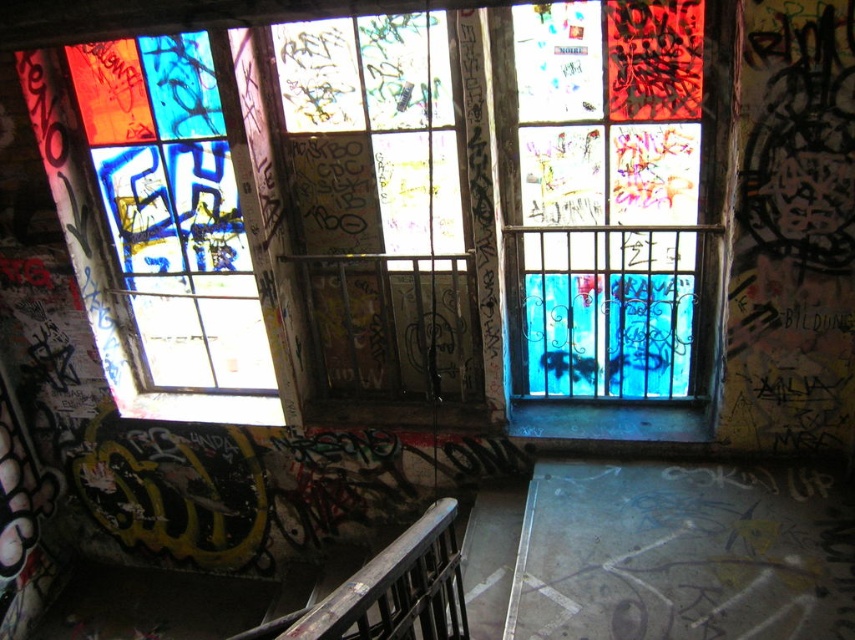
structural integrity is a concern in this abandoned building. You need to inspect the stained glass window at upper left and the dark brown wooden balustrade at center. According to their positions, which object is more likely to be unstable? Please explain your reasoning based on their locations and the scene description.

The dark brown wooden balustrade at center is more likely to be unstable because it is positioned in the center of the image, which is a common loadbearing area in structures. Additionally, wooden components in dilapidated buildings often degrade faster than glass due to environmental exposure and lack of maintenance.

You are an art student trying to sketch the stained glass windows in the image. You notice two stained glass pieces, the translucent stained glass at center and the stained glass window at upper left. Which one is located to the right of the other?

The translucent stained glass at center is positioned on the right side of the stained glass window at upper left.